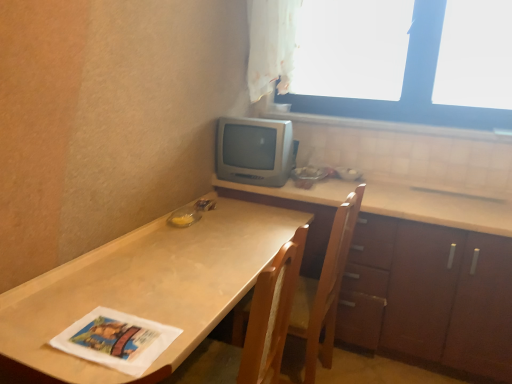
Question: Visually, is wooden cabinet at right positioned to the left or to the right of white sheer curtain at upper center?

Choices:
 (A) right
 (B) left

Answer: (A)

Question: From a real-world perspective, is wooden cabinet at right physically located above or below white sheer curtain at upper center?

Choices:
 (A) below
 (B) above

Answer: (A)

Question: Which is nearer to the silver metallic television at center?

Choices:
 (A) wooden chair at center
 (B) white sheer curtain at upper center
 (C) matte brown table at lower left
 (D) white tile at upper right
 (E) wooden cabinet at right

Answer: (B)

Question: Estimate the real-world distances between objects in this image. Which object is farther from the transparent plastic window at upper right?

Choices:
 (A) white paper magazine at lower left
 (B) wooden chair at center
 (C) silver metallic television at center
 (D) white tile at upper right
 (E) wooden cabinet at right

Answer: (A)